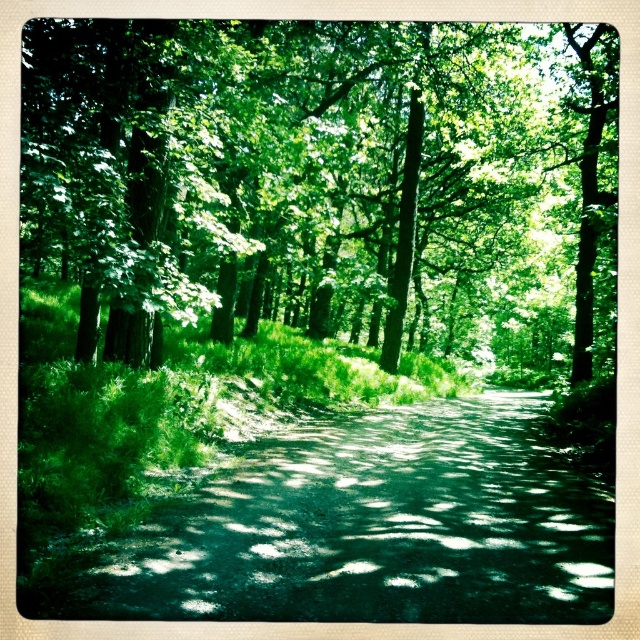
Question: Is green leafy tree at upper center below dark green asphalt at center?

Choices:
 (A) yes
 (B) no

Answer: (B)

Question: Which of the following is the farthest from the observer?

Choices:
 (A) (509, 125)
 (B) (467, 499)

Answer: (A)

Question: Which point is closer to the camera taking this photo?

Choices:
 (A) (278, 93)
 (B) (310, 509)

Answer: (B)

Question: Is green leafy tree at upper center bigger than dark green asphalt at center?

Choices:
 (A) no
 (B) yes

Answer: (B)

Question: Can you confirm if green leafy tree at upper center is bigger than dark green asphalt at center?

Choices:
 (A) no
 (B) yes

Answer: (B)